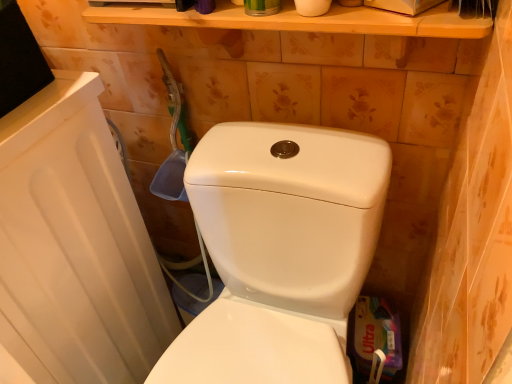
Question: From a real-world perspective, is white glossy toilet at center positioned above or below white matte toilet paper at upper center?

Choices:
 (A) above
 (B) below

Answer: (B)

Question: From the image's perspective, relative to white matte toilet paper at upper center, is white glossy toilet at center above or below?

Choices:
 (A) above
 (B) below

Answer: (B)

Question: Looking at their shapes, would you say white glossy toilet at center is wider or thinner than white matte toilet paper at upper center?

Choices:
 (A) wide
 (B) thin

Answer: (A)

Question: Would you say white matte toilet paper at upper center is to the left or to the right of white glossy toilet at center in the picture?

Choices:
 (A) right
 (B) left

Answer: (A)

Question: Considering the positions of white matte toilet paper at upper center and white glossy toilet at center in the image, is white matte toilet paper at upper center bigger or smaller than white glossy toilet at center?

Choices:
 (A) small
 (B) big

Answer: (A)

Question: Is point (325, 11) positioned closer to the camera than point (356, 225)?

Choices:
 (A) closer
 (B) farther

Answer: (A)

Question: From their relative heights in the image, would you say white matte toilet paper at upper center is taller or shorter than white glossy toilet at center?

Choices:
 (A) tall
 (B) short

Answer: (B)